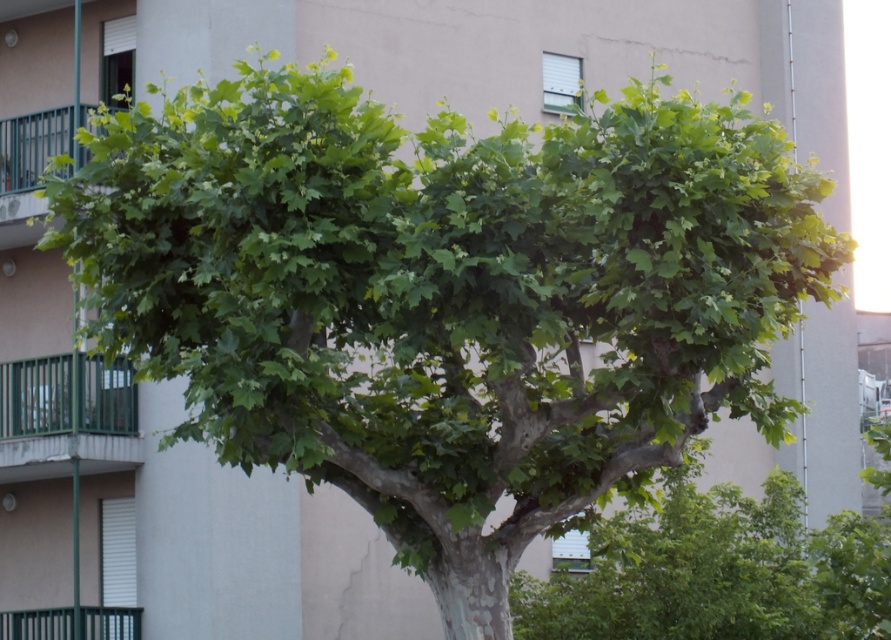
Question: Is green metal railing at lower left smaller than green metal railing at upper left?

Choices:
 (A) yes
 (B) no

Answer: (B)

Question: Which of the following is the closest to the observer?

Choices:
 (A) green metal railing at upper left
 (B) green metal railing at lower left

Answer: (A)

Question: Can you confirm if green metal railing at lower left is thinner than green metal railing at upper left?

Choices:
 (A) yes
 (B) no

Answer: (B)

Question: Can you confirm if green metal railing at lower left is positioned to the left of green metal railing at upper left?

Choices:
 (A) yes
 (B) no

Answer: (B)